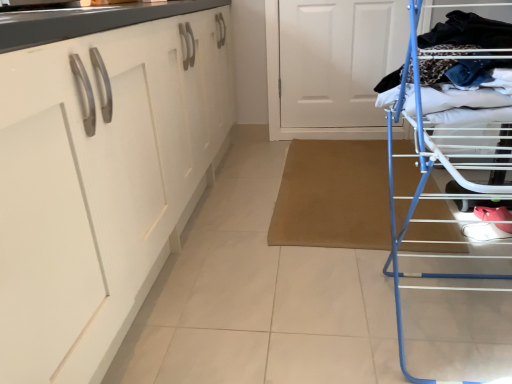
Identify the location of blue metal drying rack at right. The image size is (512, 384). [417, 186].

Where is `white matte door at upper center`? This screenshot has height=384, width=512. white matte door at upper center is located at coordinates (337, 60).

Locate an element on the screen. The image size is (512, 384). white glossy cabinet at left is located at coordinates (100, 181).

Locate an element on the screen. The image size is (512, 384). blue metal drying rack at right is located at coordinates (417, 186).

Can you confirm if white glossy cabinet at left is taller than white matte door at upper center?

Yes, white glossy cabinet at left is taller than white matte door at upper center.

Considering the points (28, 155) and (362, 17), which point is in front, point (28, 155) or point (362, 17)?

Positioned in front is point (28, 155).

From a real-world perspective, which is physically below, white glossy cabinet at left or white matte door at upper center?

white matte door at upper center is physically lower.

Where is `cabinetry that is below the white matte door at upper center (from the image's perspective)`? Image resolution: width=512 pixels, height=384 pixels. cabinetry that is below the white matte door at upper center (from the image's perspective) is located at coordinates [x=100, y=181].

Can you tell me how much blue metal drying rack at right and white matte door at upper center differ in facing direction?

The angle between the facing direction of blue metal drying rack at right and the facing direction of white matte door at upper center is 91.1 degrees.

Is point (395, 270) in front of point (405, 23)?

Yes.

Is blue metal drying rack at right facing towards white matte door at upper center?

No, blue metal drying rack at right does not turn towards white matte door at upper center.

Which object is closer to the camera, blue metal drying rack at right or white matte door at upper center?

blue metal drying rack at right is closer to the camera.

Is the surface of blue metal drying rack at right in direct contact with white glossy cabinet at left?

blue metal drying rack at right and white glossy cabinet at left are clearly separated.

Is blue metal drying rack at right facing towards white glossy cabinet at left?

Yes, blue metal drying rack at right is oriented towards white glossy cabinet at left.

Considering the positions of objects blue metal drying rack at right and white glossy cabinet at left in the image provided, who is behind, blue metal drying rack at right or white glossy cabinet at left?

blue metal drying rack at right is more distant.

Does point (389, 196) appear closer or farther from the camera than point (154, 243)?

Point (389, 196).

Between white glossy cabinet at left and blue metal drying rack at right, which one appears on the right side from the viewer's perspective?

blue metal drying rack at right.

Considering the sizes of objects white glossy cabinet at left and blue metal drying rack at right in the image provided, who is shorter, white glossy cabinet at left or blue metal drying rack at right?

With less height is blue metal drying rack at right.

Is point (118, 36) farther from camera compared to point (418, 146)?

Yes, point (118, 36) is farther from viewer.

Which object is further away from the camera, white glossy cabinet at left or blue metal drying rack at right?

blue metal drying rack at right is more distant.

Between white matte door at upper center and blue metal drying rack at right, which one has smaller size?

white matte door at upper center.

Based on their positions, is white matte door at upper center located to the left or right of blue metal drying rack at right?

Clearly, white matte door at upper center is on the left of blue metal drying rack at right in the image.

From a real-world perspective, is white matte door at upper center on blue metal drying rack at right?

Incorrect, from a real-world perspective, white matte door at upper center is lower than blue metal drying rack at right.

Looking at this image, are white matte door at upper center and blue metal drying rack at right located far from each other?

Yes, white matte door at upper center is far from blue metal drying rack at right.

How far apart are white matte door at upper center and white glossy cabinet at left?

white matte door at upper center and white glossy cabinet at left are 4.88 feet apart from each other.

Visually, is white matte door at upper center positioned to the left or to the right of white glossy cabinet at left?

Clearly, white matte door at upper center is on the right of white glossy cabinet at left in the image.

Can you confirm if white matte door at upper center is wider than white glossy cabinet at left?

Incorrect, the width of white matte door at upper center does not surpass that of white glossy cabinet at left.

In the image, there is a white glossy cabinet at left. Identify the location of door below it (from a real-world perspective). This screenshot has height=384, width=512. (337, 60).

Identify the location of door on the left of the blue metal drying rack at right. (337, 60).

Considering their positions, is white glossy cabinet at left positioned further to blue metal drying rack at right than white matte door at upper center?

Among the two, white matte door at upper center is located further to blue metal drying rack at right.

Which object lies nearer to the anchor point white matte door at upper center, white glossy cabinet at left or blue metal drying rack at right?

white glossy cabinet at left is closer to white matte door at upper center.

When comparing their distances from blue metal drying rack at right, does white matte door at upper center or white glossy cabinet at left seem further?

white matte door at upper center.

Looking at the image, which one is located closer to white matte door at upper center, blue metal drying rack at right or white glossy cabinet at left?

Based on the image, white glossy cabinet at left appears to be nearer to white matte door at upper center.

Looking at the image, which one is located closer to white glossy cabinet at left, white matte door at upper center or blue metal drying rack at right?

blue metal drying rack at right is closer to white glossy cabinet at left.

From the image, which object appears to be farther from white glossy cabinet at left, blue metal drying rack at right or white matte door at upper center?

white matte door at upper center.

Image resolution: width=512 pixels, height=384 pixels. I want to click on furniture positioned between white glossy cabinet at left and white matte door at upper center from near to far, so (417, 186).